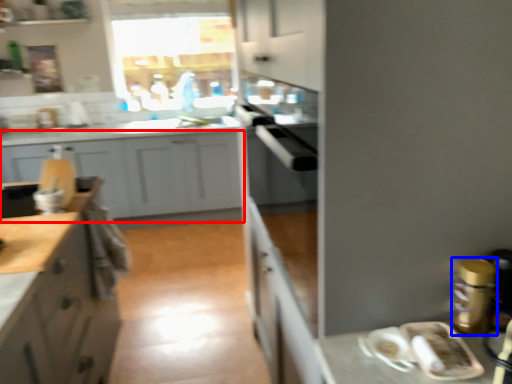
Question: Which point is closer to the camera, cabinetry (highlighted by a red box) or appliance (highlighted by a blue box)?

Choices:
 (A) cabinetry
 (B) appliance

Answer: (B)